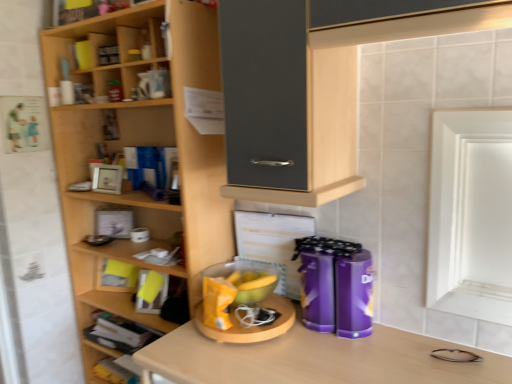
The height and width of the screenshot is (384, 512). What are the coordinates of `vacant space that is to the left of purple glossy canisters at center, placed as the second appliance when sorted from left to right` in the screenshot? It's located at (291, 348).